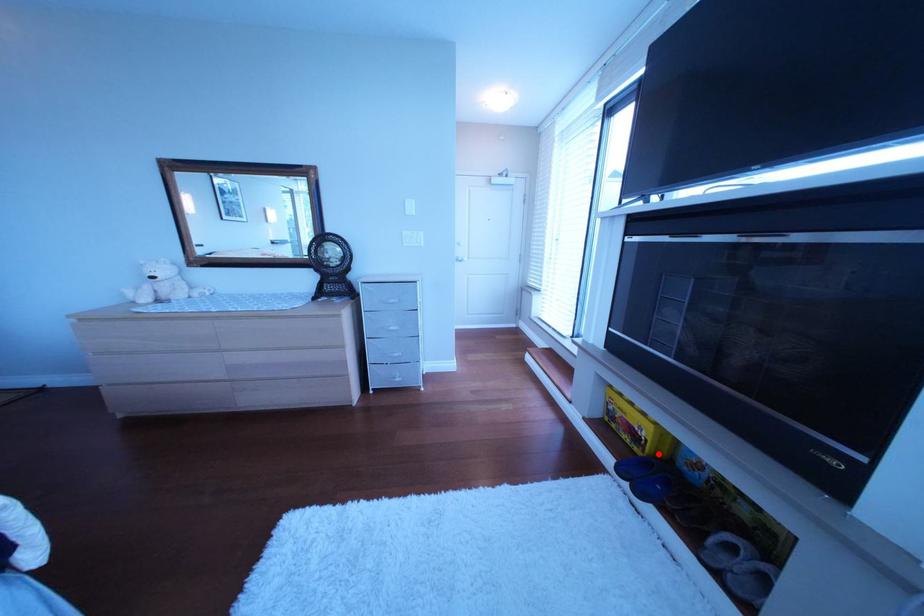
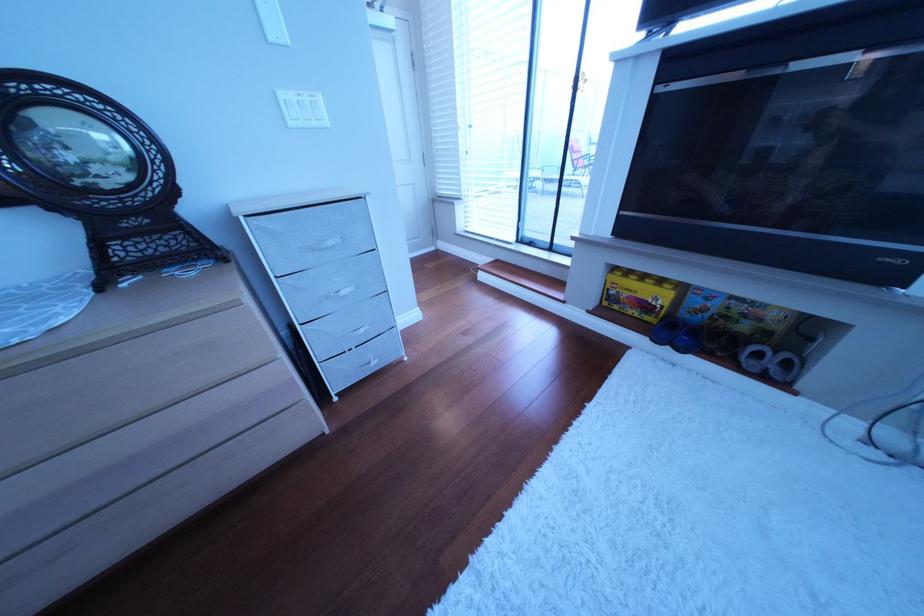
In the second image, find the point that corresponds to the highlighted location in the first image.

(672, 320)